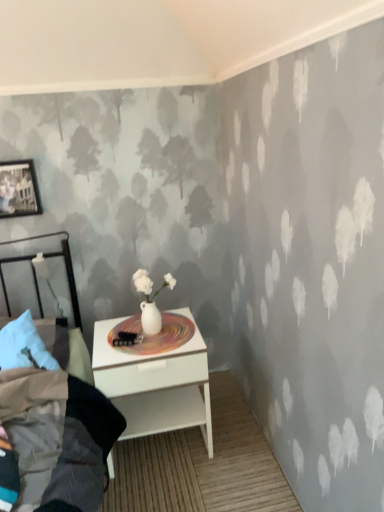
What do you see at coordinates (154, 335) in the screenshot? I see `white glossy vase at center` at bounding box center [154, 335].

Describe the element at coordinates (18, 189) in the screenshot. I see `matte black picture frame at upper left` at that location.

This screenshot has width=384, height=512. Identify the location of white glossy vase at center. (154, 335).

Based on their sizes in the image, would you say white glossy vase at center is bigger or smaller than white glossy nightstand at lower center?

In the image, white glossy vase at center appears to be smaller than white glossy nightstand at lower center.

Can you tell me how much white glossy vase at center and white glossy nightstand at lower center differ in facing direction?

They differ by 0.000248 degrees in their facing directions.

From the image's perspective, who appears lower, white glossy vase at center or white glossy nightstand at lower center?

white glossy nightstand at lower center is shown below in the image.

Is white glossy vase at center located outside white glossy nightstand at lower center?

No, white glossy vase at center is not outside of white glossy nightstand at lower center.

Would you say white glossy nightstand at lower center is outside matte black picture frame at upper left?

Yes.

Is white glossy nightstand at lower center bigger than matte black picture frame at upper left?

Yes, white glossy nightstand at lower center is bigger than matte black picture frame at upper left.

Considering the sizes of objects white glossy nightstand at lower center and matte black picture frame at upper left in the image provided, who is taller, white glossy nightstand at lower center or matte black picture frame at upper left?

white glossy nightstand at lower center.

Is matte black picture frame at upper left at the back of white glossy nightstand at lower center?

No.

Is point (36, 202) positioned after point (123, 335)?

Yes, it is behind point (123, 335).

Is matte black picture frame at upper left with white glossy vase at center?

matte black picture frame at upper left is not next to white glossy vase at center, and they're not touching.

From the image's perspective, is matte black picture frame at upper left under white glossy vase at center?

Actually, matte black picture frame at upper left appears above white glossy vase at center in the image.

Is matte black picture frame at upper left facing away from white glossy vase at center?

No.

Is there a large distance between white glossy vase at center and matte black picture frame at upper left?

Actually, white glossy vase at center and matte black picture frame at upper left are a little close together.

From their relative heights in the image, would you say white glossy vase at center is taller or shorter than matte black picture frame at upper left?

In the image, white glossy vase at center appears to be shorter than matte black picture frame at upper left.

Between white glossy vase at center and matte black picture frame at upper left, which one is positioned in front?

white glossy vase at center is closer to the camera.

Measure the distance from white glossy vase at center to matte black picture frame at upper left.

The distance of white glossy vase at center from matte black picture frame at upper left is 31.99 inches.

Which is more to the left, matte black picture frame at upper left or white glossy nightstand at lower center?

From the viewer's perspective, matte black picture frame at upper left appears more on the left side.

Looking at this image, is matte black picture frame at upper left smaller than white glossy nightstand at lower center?

Yes, matte black picture frame at upper left is smaller than white glossy nightstand at lower center.

Is matte black picture frame at upper left aimed at white glossy nightstand at lower center?

No.

Image resolution: width=384 pixels, height=512 pixels. I want to click on nightstand below the matte black picture frame at upper left (from the image's perspective), so click(x=155, y=384).

Is point (209, 428) closer to viewer compared to point (183, 318)?

Yes.

Consider the image. Which of these two, white glossy nightstand at lower center or white glossy vase at center, is thinner?

white glossy vase at center is thinner.

Is white glossy nightstand at lower center placed right next to white glossy vase at center?

No, white glossy nightstand at lower center is not beside white glossy vase at center.

Locate an element on the screen. This screenshot has width=384, height=512. round table above the white glossy nightstand at lower center (from the image's perspective) is located at coordinates (154, 335).

Locate an element on the screen. This screenshot has height=512, width=384. nightstand below the matte black picture frame at upper left (from the image's perspective) is located at coordinates (155, 384).

Looking at the image, which one is located closer to matte black picture frame at upper left, white glossy nightstand at lower center or white glossy vase at center?

Based on the image, white glossy vase at center appears to be nearer to matte black picture frame at upper left.

From the image, which object appears to be nearer to white glossy vase at center, matte black picture frame at upper left or white glossy nightstand at lower center?

white glossy nightstand at lower center is positioned closer to the anchor white glossy vase at center.

Estimate the real-world distances between objects in this image. Which object is further from white glossy vase at center, white glossy nightstand at lower center or matte black picture frame at upper left?

matte black picture frame at upper left.

From the image, which object appears to be farther from white glossy nightstand at lower center, white glossy vase at center or matte black picture frame at upper left?

Based on the image, matte black picture frame at upper left appears to be further to white glossy nightstand at lower center.

Estimate the real-world distances between objects in this image. Which object is closer to matte black picture frame at upper left, white glossy vase at center or white glossy nightstand at lower center?

Based on the image, white glossy vase at center appears to be nearer to matte black picture frame at upper left.

When comparing their distances from white glossy nightstand at lower center, does matte black picture frame at upper left or white glossy vase at center seem further?

matte black picture frame at upper left.

At what (x,y) coordinates should I click in order to perform the action: click on round table between matte black picture frame at upper left and white glossy nightstand at lower center in the up-down direction. Please return your answer as a coordinate pair (x, y). The width and height of the screenshot is (384, 512). Looking at the image, I should click on (154, 335).